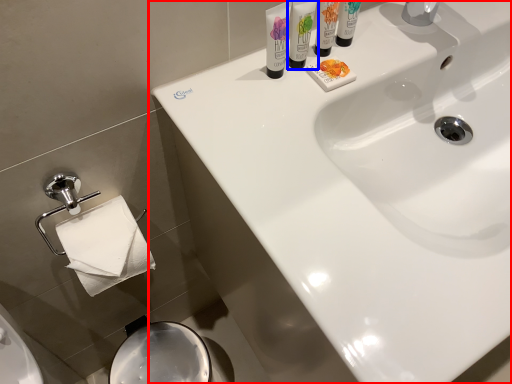
Question: Which object appears closest to the camera in this image, sink (highlighted by a red box) or shaving cream (highlighted by a blue box)?

Choices:
 (A) sink
 (B) shaving cream

Answer: (A)